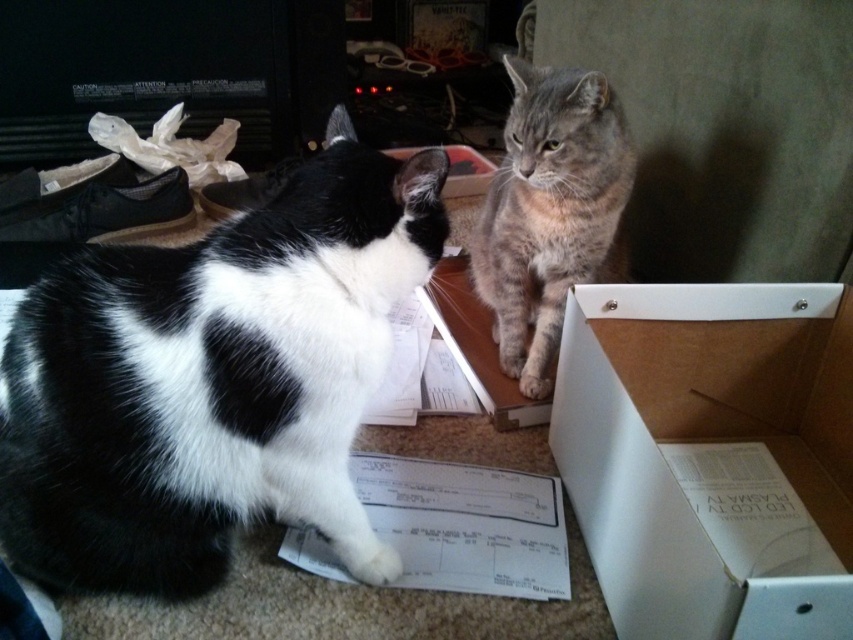
You are standing in a room with a cat. You see the black and white fur cat at left. Where is the cat located in the room?

The black and white fur cat at left is located at point 0.595 on the x axis and 0.250 on the y axis.

You are a photographer trying to capture both cats in the image. You want to ensure that both cats are in focus. Given that your camera can only focus on objects within a 0.1 unit depth range, will both cats be in focus if you focus on the midpoint between point (x=596, y=333) and point (x=531, y=176)?

The distance between the two points is sqrt of squared differences in coordinates. The midpoint is at average of coordinates. The depth difference between the two points is 0.523 vs 0.275? Wait, the description says point 0.523,0.701 is closer. Wait, the coordinates are given as point 0.523,0.701 and point 0.275,0.623. The objects description says the first point is closer. So the depth of the first point is less than the second? Wait, in 2D coordinates, but the description refers to 3D depth. Hmm. The user